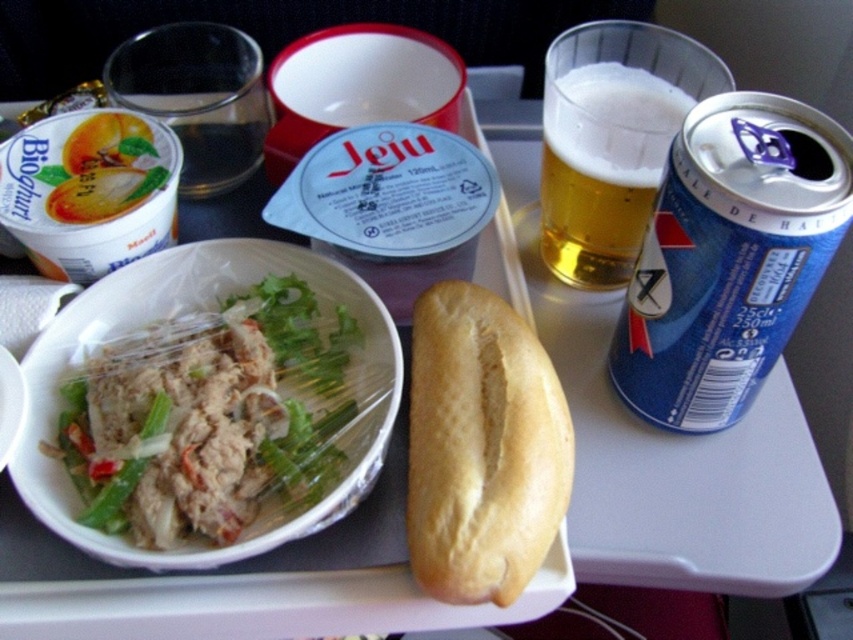
Question: Can you confirm if blue matte yogurt at upper left is bigger than golden brown crusty bread at center?

Choices:
 (A) no
 (B) yes

Answer: (B)

Question: Can you confirm if golden brown crusty bread at center is thinner than golden lager glass at upper right?

Choices:
 (A) yes
 (B) no

Answer: (A)

Question: Can you confirm if white plastic bowl at center-left is positioned below golden brown crusty bread at center?

Choices:
 (A) yes
 (B) no

Answer: (B)

Question: Estimate the real-world distances between objects in this image. Which object is farther from the white plastic bowl at center-left?

Choices:
 (A) golden brown crusty bread at center
 (B) golden lager glass at upper right

Answer: (B)

Question: Considering the real-world distances, which object is farthest from the white plastic bowl at center-left?

Choices:
 (A) golden lager glass at upper right
 (B) golden brown crusty bread at center

Answer: (A)

Question: Which object is closer to the camera taking this photo?

Choices:
 (A) white plastic bowl at center-left
 (B) golden brown crusty bread at center

Answer: (B)